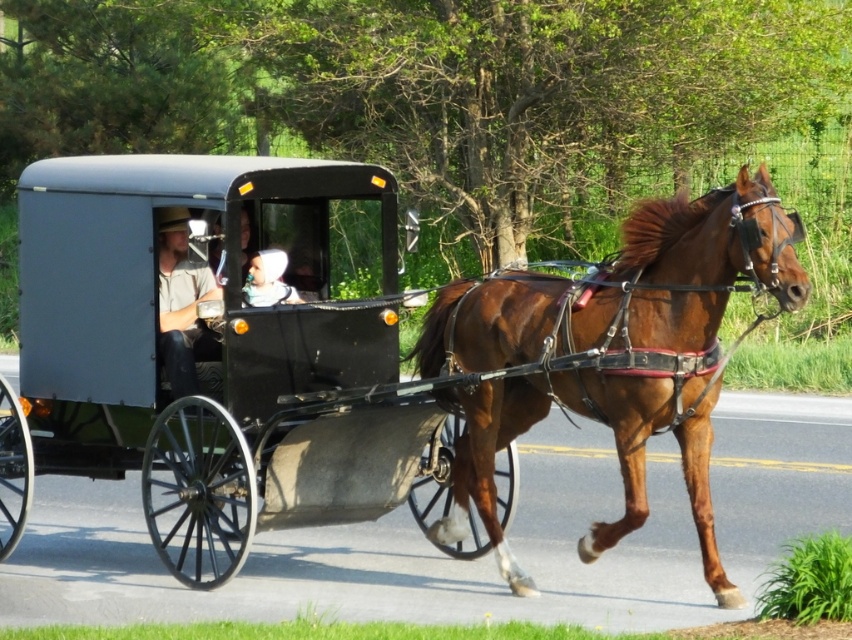
Which of these two, brown glossy horse at center or white fabric headscarf at center, stands shorter?

white fabric headscarf at center is shorter.

Does brown glossy horse at center appear on the right side of white fabric headscarf at center?

Yes, brown glossy horse at center is to the right of white fabric headscarf at center.

Which is behind, point (533, 592) or point (281, 289)?

The point (281, 289) is behind.

In order to click on brown glossy horse at center in this screenshot , I will do `click(626, 285)`.

From the picture: Is matte black horse cart at center behind matte gray hat at center?

No, matte black horse cart at center is in front of matte gray hat at center.

This screenshot has height=640, width=852. I want to click on matte black horse cart at center, so click(355, 356).

This screenshot has height=640, width=852. What are the coordinates of `matte black horse cart at center` in the screenshot? It's located at (355, 356).

Who is higher up, matte gray hat at center or white fabric headscarf at center?

matte gray hat at center

What do you see at coordinates (182, 304) in the screenshot?
I see `matte gray hat at center` at bounding box center [182, 304].

Locate an element on the screen. The width and height of the screenshot is (852, 640). matte gray hat at center is located at coordinates (182, 304).